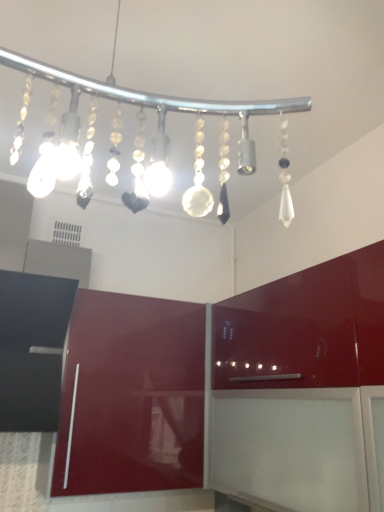
Question: Is glossy burgundy cabinet at lower left, which is counted as the 2th cabinetry, starting from the right, further to camera compared to clear glass chandelier at upper center?

Choices:
 (A) yes
 (B) no

Answer: (A)

Question: Considering the relative sizes of glossy burgundy cabinet at lower left, the 1th cabinetry in the left-to-right sequence, and clear glass chandelier at upper center in the image provided, is glossy burgundy cabinet at lower left, the 1th cabinetry in the left-to-right sequence, shorter than clear glass chandelier at upper center?

Choices:
 (A) no
 (B) yes

Answer: (A)

Question: Is glossy burgundy cabinet at lower left, the 1th cabinetry in the left-to-right sequence, thinner than clear glass chandelier at upper center?

Choices:
 (A) no
 (B) yes

Answer: (B)

Question: Can you confirm if glossy burgundy cabinet at lower left, the 1th cabinetry in the left-to-right sequence, is positioned to the left of clear glass chandelier at upper center?

Choices:
 (A) no
 (B) yes

Answer: (B)

Question: Is glossy burgundy cabinet at lower left, the 1th cabinetry in the left-to-right sequence, wider than clear glass chandelier at upper center?

Choices:
 (A) yes
 (B) no

Answer: (B)

Question: Do you think glossy red cabinet at center, the first cabinetry positioned from the right, is within glossy burgundy cabinet at lower left, which is counted as the 2th cabinetry, starting from the right, or outside of it?

Choices:
 (A) inside
 (B) outside

Answer: (B)

Question: In terms of size, does glossy red cabinet at center, which is counted as the 2th cabinetry, starting from the left, appear bigger or smaller than glossy burgundy cabinet at lower left, which is counted as the 2th cabinetry, starting from the right?

Choices:
 (A) small
 (B) big

Answer: (B)

Question: Is glossy red cabinet at center, which is counted as the 2th cabinetry, starting from the left, taller or shorter than glossy burgundy cabinet at lower left, which is counted as the 2th cabinetry, starting from the right?

Choices:
 (A) short
 (B) tall

Answer: (A)

Question: From a real-world perspective, is glossy red cabinet at center, which is counted as the 2th cabinetry, starting from the left, positioned above or below glossy burgundy cabinet at lower left, which is counted as the 2th cabinetry, starting from the right?

Choices:
 (A) below
 (B) above

Answer: (B)

Question: Is point (170, 442) positioned closer to the camera than point (190, 409)?

Choices:
 (A) closer
 (B) farther

Answer: (A)

Question: From the image's perspective, is glossy burgundy cabinet at lower left, the 1th cabinetry in the left-to-right sequence, located above or below glossy red cabinet at center, which is counted as the 2th cabinetry, starting from the left?

Choices:
 (A) above
 (B) below

Answer: (B)

Question: From a real-world perspective, is glossy burgundy cabinet at lower left, the 1th cabinetry in the left-to-right sequence, above or below glossy red cabinet at center, the first cabinetry positioned from the right?

Choices:
 (A) below
 (B) above

Answer: (A)

Question: Visually, is glossy burgundy cabinet at lower left, which is counted as the 2th cabinetry, starting from the right, positioned to the left or to the right of glossy red cabinet at center, the first cabinetry positioned from the right?

Choices:
 (A) left
 (B) right

Answer: (A)

Question: Considering the positions of clear glass chandelier at upper center and glossy burgundy cabinet at lower left, the 1th cabinetry in the left-to-right sequence, in the image, is clear glass chandelier at upper center wider or thinner than glossy burgundy cabinet at lower left, the 1th cabinetry in the left-to-right sequence,?

Choices:
 (A) thin
 (B) wide

Answer: (B)

Question: Considering the positions of clear glass chandelier at upper center and glossy burgundy cabinet at lower left, which is counted as the 2th cabinetry, starting from the right, in the image, is clear glass chandelier at upper center taller or shorter than glossy burgundy cabinet at lower left, which is counted as the 2th cabinetry, starting from the right,?

Choices:
 (A) tall
 (B) short

Answer: (B)